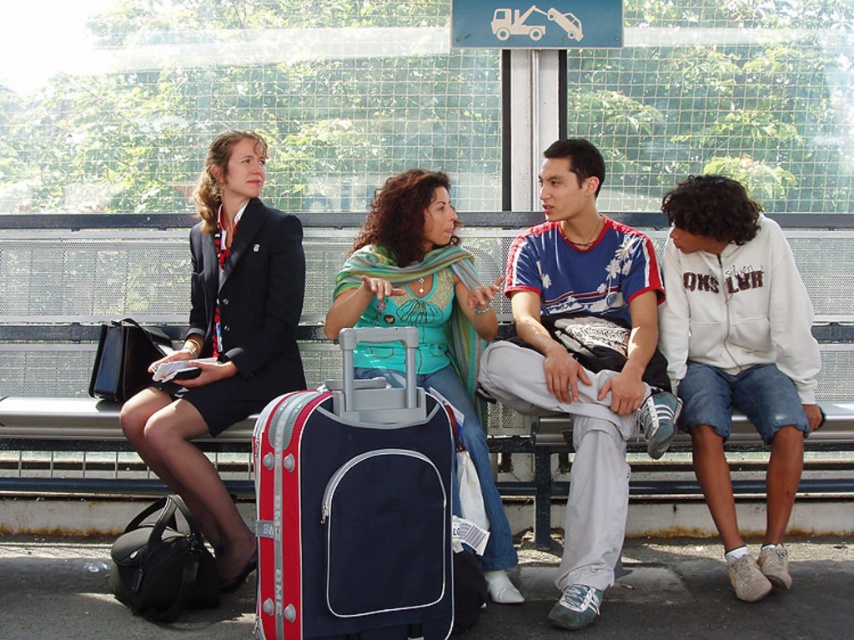
Can you confirm if metallic silver bench at center is wider than white fleece jacket at right?

Yes, metallic silver bench at center is wider than white fleece jacket at right.

Describe the element at coordinates (75, 362) in the screenshot. I see `metallic silver bench at center` at that location.

Find the location of `metallic silver bench at center`. metallic silver bench at center is located at coordinates (75, 362).

Between metallic silver bench at center and green striped scarf at center, which one is positioned lower?

green striped scarf at center is below.

Can you confirm if metallic silver bench at center is taller than green striped scarf at center?

No, metallic silver bench at center is not taller than green striped scarf at center.

Is point (127, 282) closer to viewer compared to point (487, 547)?

No, (127, 282) is further to viewer.

Locate an element on the screen. The width and height of the screenshot is (854, 640). metallic silver bench at center is located at coordinates (75, 362).

Does metallic silver bench at center appear on the left side of blue fabric suitcase at center?

Indeed, metallic silver bench at center is positioned on the left side of blue fabric suitcase at center.

Does point (47, 531) lie in front of point (393, 593)?

No, (47, 531) is behind (393, 593).

This screenshot has height=640, width=854. I want to click on metallic silver bench at center, so click(x=75, y=362).